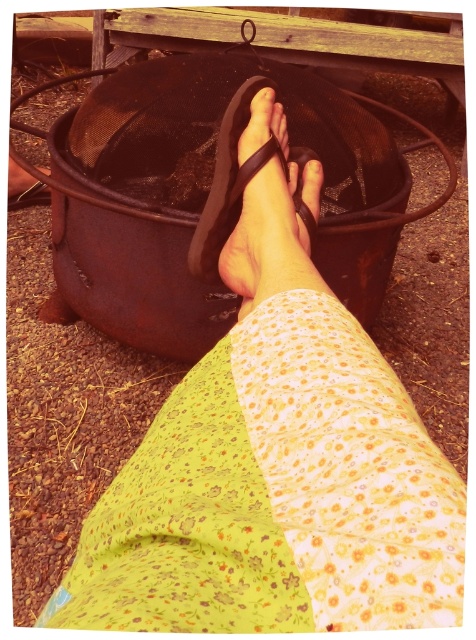
Question: Which of the following is the farthest from the observer?

Choices:
 (A) (218, 218)
 (B) (298, 176)

Answer: (B)

Question: Which object is farther from the camera taking this photo?

Choices:
 (A) black rubber sandal at center
 (B) matte black toe at center

Answer: (B)

Question: Where is black rubber sandal at center located in relation to matte black toe at center in the image?

Choices:
 (A) left
 (B) right

Answer: (A)

Question: Does black rubber sandal at center appear under matte black toe at center?

Choices:
 (A) no
 (B) yes

Answer: (A)

Question: Which point is farther from the camera taking this photo?

Choices:
 (A) (219, 205)
 (B) (290, 168)

Answer: (B)

Question: Is black rubber sandal at center behind matte black toe at center?

Choices:
 (A) yes
 (B) no

Answer: (B)